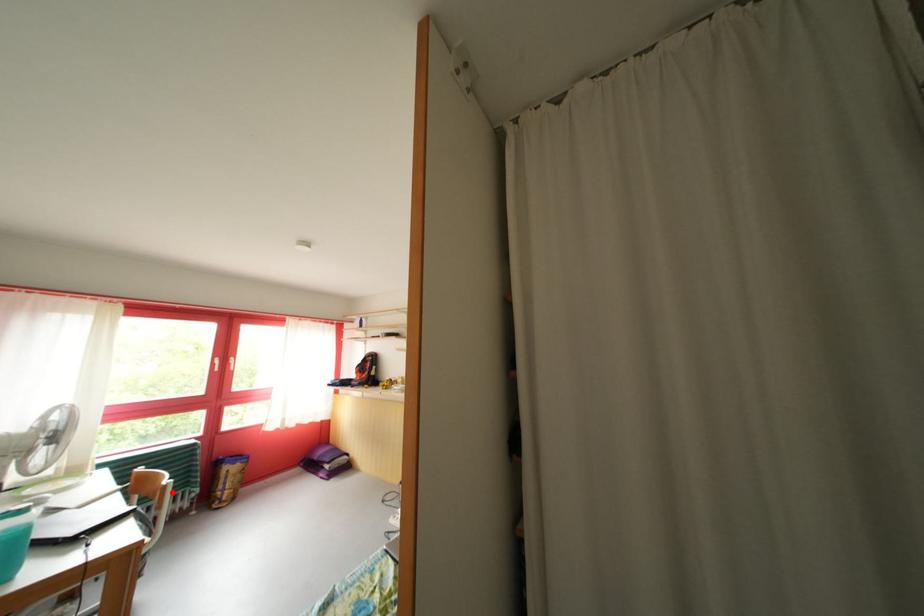
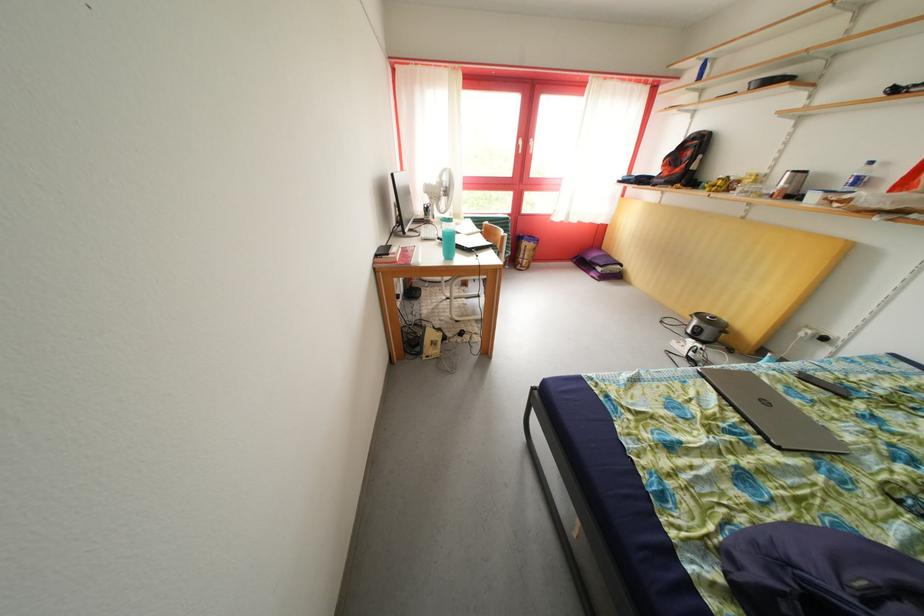
Find the pixel in the second image that matches the highlighted location in the first image.

(511, 243)